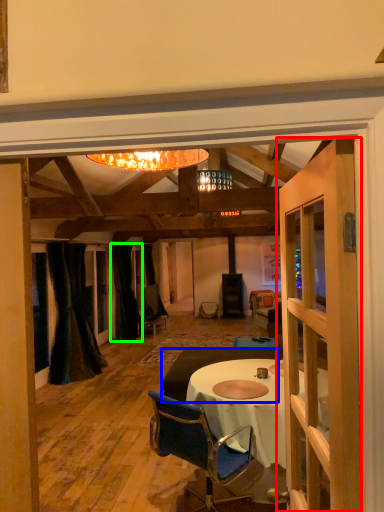
Question: Considering the real-world distances, which object is closest to door (highlighted by a red box)? studio couch (highlighted by a blue box) or curtain (highlighted by a green box).

Choices:
 (A) studio couch
 (B) curtain

Answer: (A)